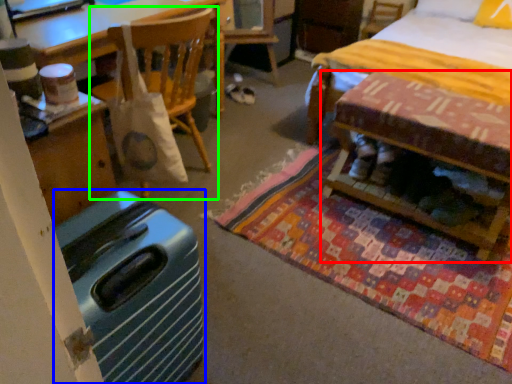
Question: Considering the real-world distances, which object is closest to table (highlighted by a red box)? luggage (highlighted by a blue box) or chair (highlighted by a green box).

Choices:
 (A) luggage
 (B) chair

Answer: (B)